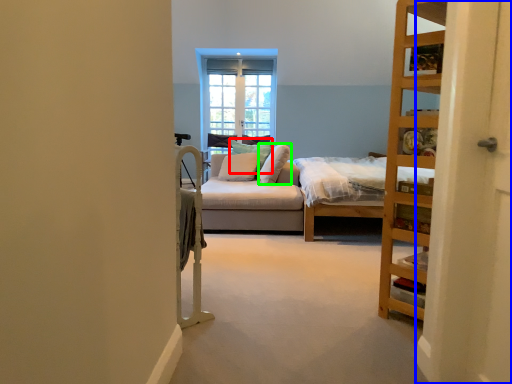
Question: Considering the real-world distances, which object is closest to pillow (highlighted by a red box)? screen door (highlighted by a blue box) or pillow (highlighted by a green box).

Choices:
 (A) screen door
 (B) pillow

Answer: (B)